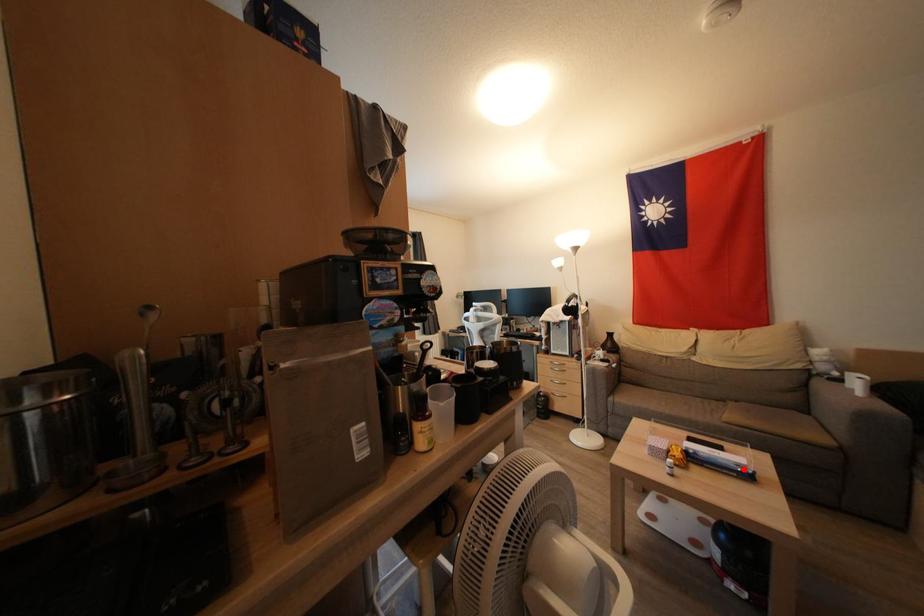
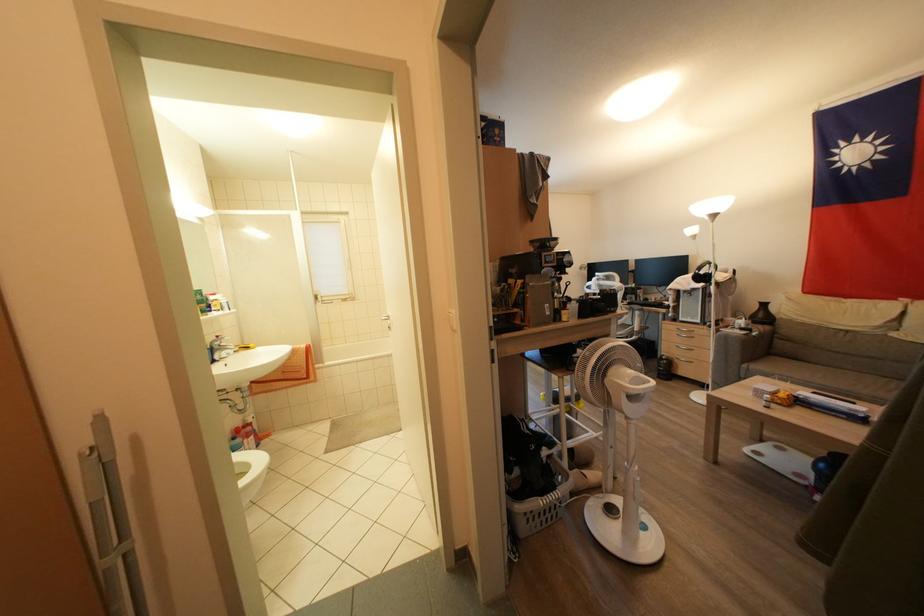
The point at the highlighted location is marked in the first image. Where is the corresponding point in the second image?

(858, 415)